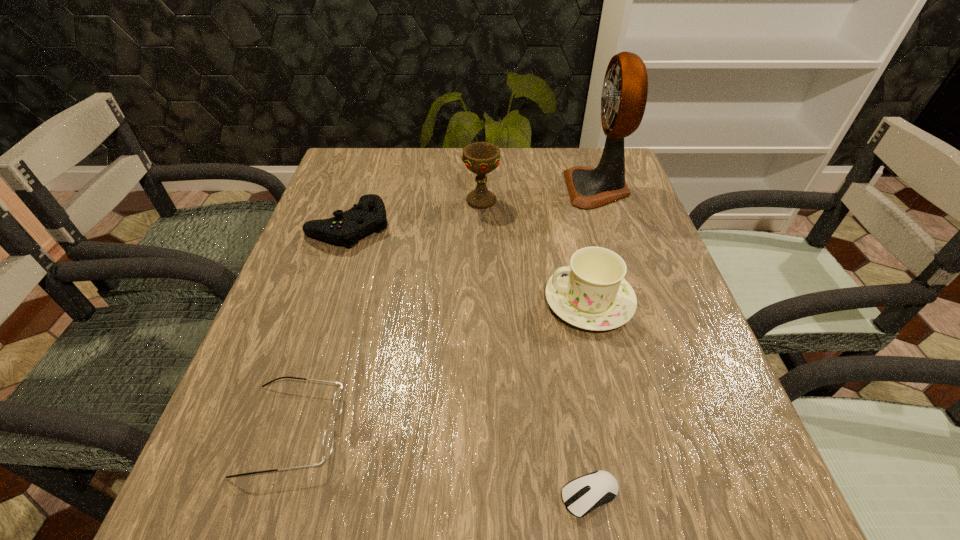
Where is `spectacles located at the near edge`? The image size is (960, 540). spectacles located at the near edge is located at coordinates coord(328,439).

Find the location of a particular element. Image resolution: width=960 pixels, height=540 pixels. mouse that is positioned at the near edge is located at coordinates (582, 495).

Image resolution: width=960 pixels, height=540 pixels. In order to click on control at the left edge in this screenshot , I will do `click(345, 228)`.

Where is `spectacles situated at the left edge`? The image size is (960, 540). spectacles situated at the left edge is located at coordinates (328, 439).

The image size is (960, 540). I want to click on fan at the right edge, so click(x=624, y=95).

Where is `chinaware that is at the right edge`? This screenshot has width=960, height=540. chinaware that is at the right edge is located at coordinates (592, 294).

You are a GUI agent. You are given a task and a screenshot of the screen. Output one action in this format:
    pyautogui.click(x=<x>, y=<y>)
    Task: Click on the object at the near left corner
    
    Given the screenshot: What is the action you would take?
    pyautogui.click(x=328, y=439)

I want to click on object at the far right corner, so click(x=624, y=95).

The height and width of the screenshot is (540, 960). I want to click on blank space at the far edge of the desktop, so click(400, 166).

You are a GUI agent. You are given a task and a screenshot of the screen. Output one action in this format:
    pyautogui.click(x=<x>, y=<y>)
    Task: Click on the free space at the near edge of the desktop
    This screenshot has height=540, width=960.
    Given the screenshot: What is the action you would take?
    pyautogui.click(x=430, y=518)